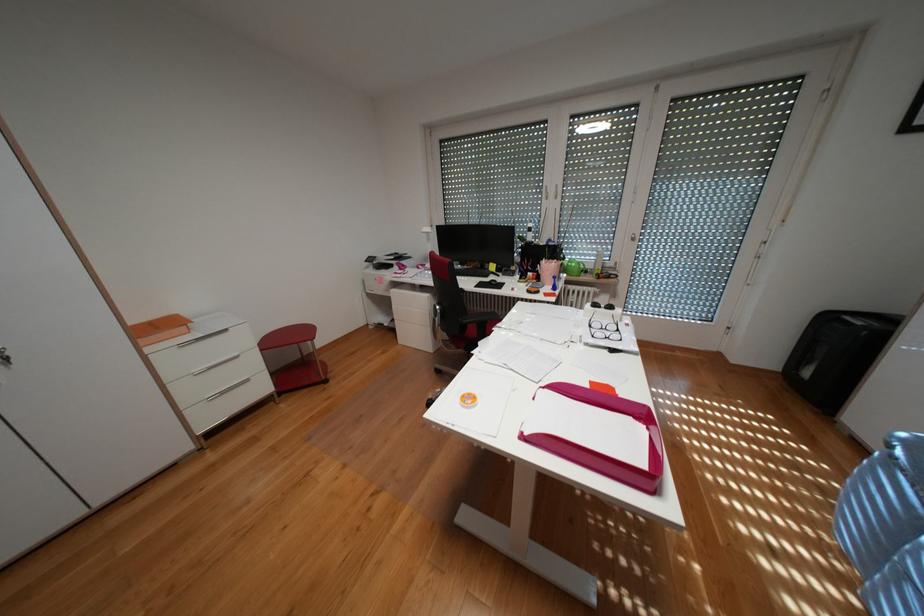
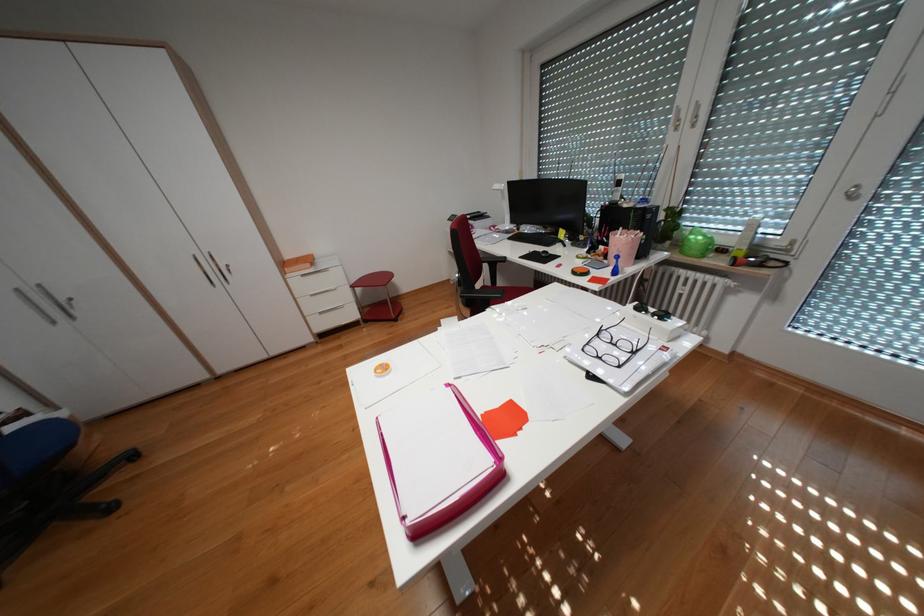
Question: I am providing you with two images of the same scene from different viewpoints. Please identify which objects are invisible in image2.

Choices:
 (A) computer mouse
 (B) white drawer handle
 (C) black chair armrest
 (D) none of these

Answer: (D)